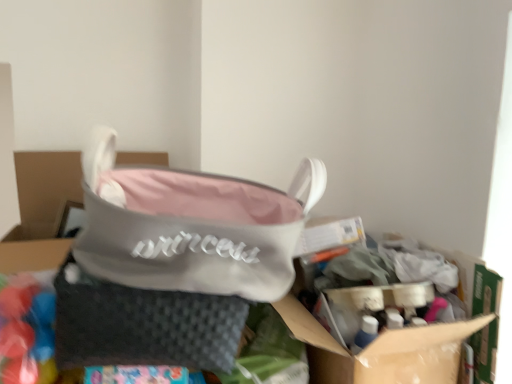
Question: Considering the relative positions of pink fabric handbag at center and cardboard box at center in the image provided, is pink fabric handbag at center to the right of cardboard box at center from the viewer's perspective?

Choices:
 (A) yes
 (B) no

Answer: (B)

Question: Is pink fabric handbag at center next to cardboard box at center?

Choices:
 (A) yes
 (B) no

Answer: (B)

Question: Is pink fabric handbag at center to the left of cardboard box at center from the viewer's perspective?

Choices:
 (A) no
 (B) yes

Answer: (B)

Question: Is cardboard box at center a part of pink fabric handbag at center?

Choices:
 (A) no
 (B) yes

Answer: (A)

Question: From the image's perspective, is pink fabric handbag at center on top of cardboard box at center?

Choices:
 (A) no
 (B) yes

Answer: (B)

Question: Considering the positions of gray woven pouch at center and pink fabric handbag at center in the image, is gray woven pouch at center taller or shorter than pink fabric handbag at center?

Choices:
 (A) tall
 (B) short

Answer: (B)

Question: Based on their sizes in the image, would you say gray woven pouch at center is bigger or smaller than pink fabric handbag at center?

Choices:
 (A) big
 (B) small

Answer: (B)

Question: Is gray woven pouch at center spatially inside pink fabric handbag at center, or outside of it?

Choices:
 (A) inside
 (B) outside

Answer: (B)

Question: Based on their positions, is gray woven pouch at center located to the left or right of pink fabric handbag at center?

Choices:
 (A) right
 (B) left

Answer: (B)

Question: Is pink fabric handbag at center in front of or behind cardboard box at center in the image?

Choices:
 (A) front
 (B) behind

Answer: (A)

Question: From a real-world perspective, relative to cardboard box at center, is pink fabric handbag at center vertically above or below?

Choices:
 (A) above
 (B) below

Answer: (A)

Question: From the image's perspective, relative to cardboard box at center, is pink fabric handbag at center above or below?

Choices:
 (A) above
 (B) below

Answer: (A)

Question: Is pink fabric handbag at center wider or thinner than cardboard box at center?

Choices:
 (A) thin
 (B) wide

Answer: (A)

Question: From the image's perspective, is cardboard box at center located above or below gray woven pouch at center?

Choices:
 (A) below
 (B) above

Answer: (A)

Question: From a real-world perspective, is cardboard box at center above or below gray woven pouch at center?

Choices:
 (A) above
 (B) below

Answer: (B)